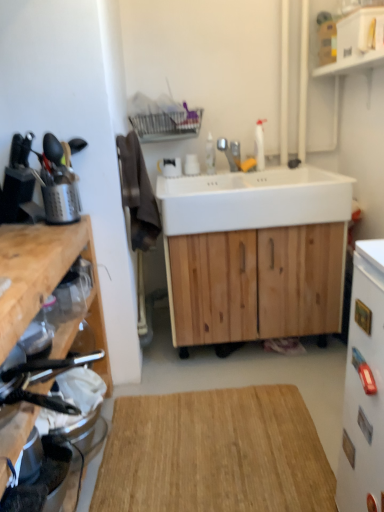
Identify the location of vacant space in front of silver metallic faucet at center. The image size is (384, 512). (240, 177).